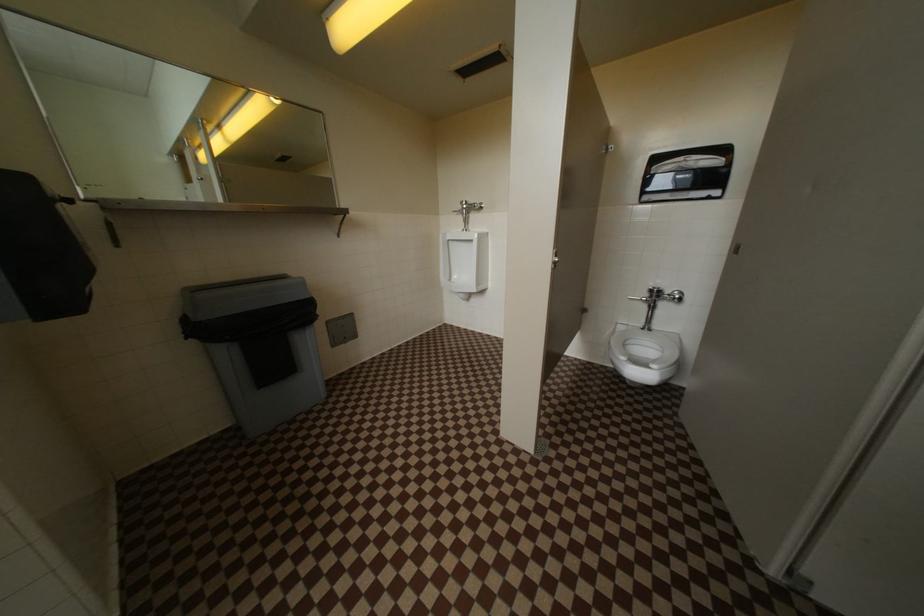
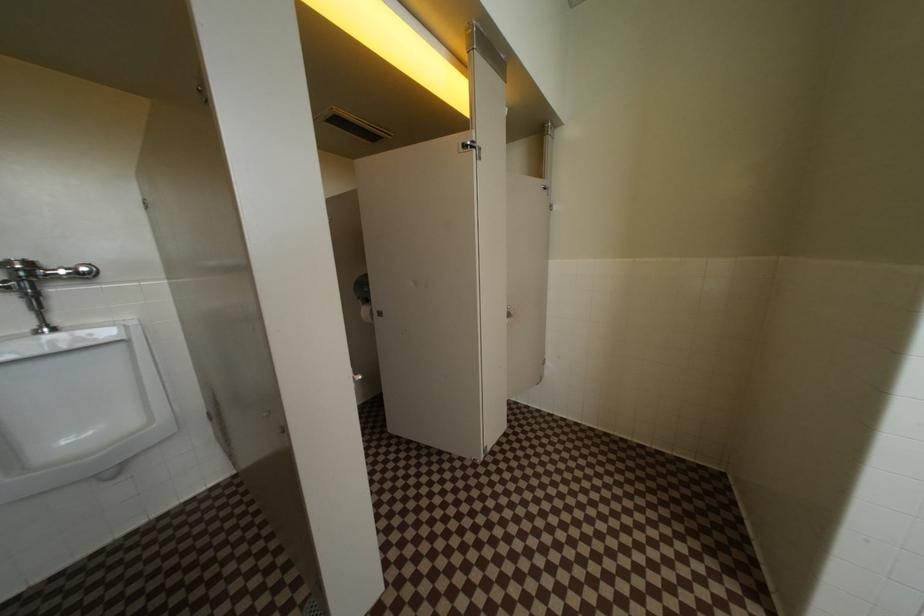
Question: How did the camera likely rotate?

Choices:
 (A) Left
 (B) Right
 (C) Up
 (D) Down

Answer: (B)